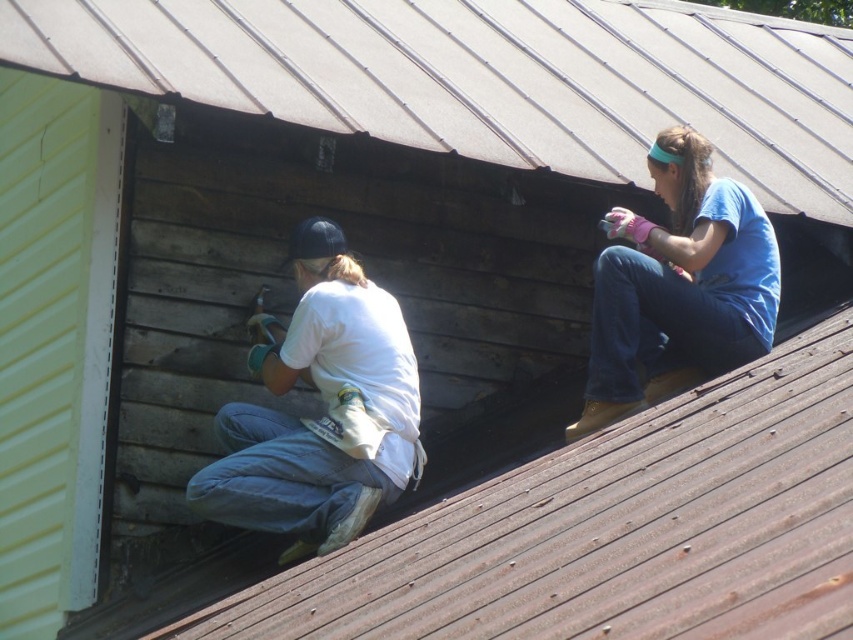
You are a safety inspector evaluating the roof work area. You notice two workers, one wearing a white matte shirt at lower left and the other in a blue cotton shirt at upper right. According to safety protocols, workers must maintain a minimum distance of 1 meter between each other on the roof. Can you determine if they are complying with this requirement based on their positions?

Result: The white matte shirt at lower left is positioned on the left side of blue cotton shirt at upper right. Since the exact distance isn